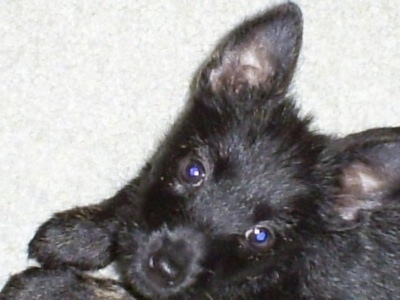
Find the location of a particular element. Image resolution: width=400 pixels, height=300 pixels. wall is located at coordinates (150, 54).